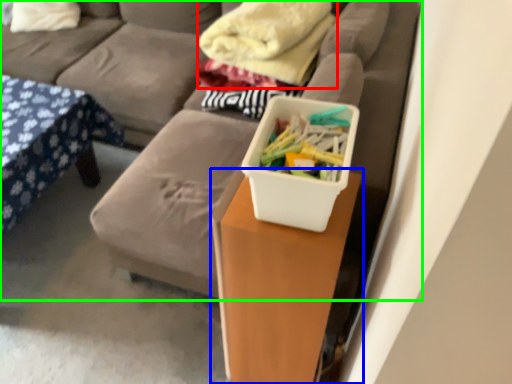
Question: Which object is positioned closest to blanket (highlighted by a red box)? Select from table (highlighted by a blue box) and studio couch (highlighted by a green box).

Choices:
 (A) table
 (B) studio couch

Answer: (B)